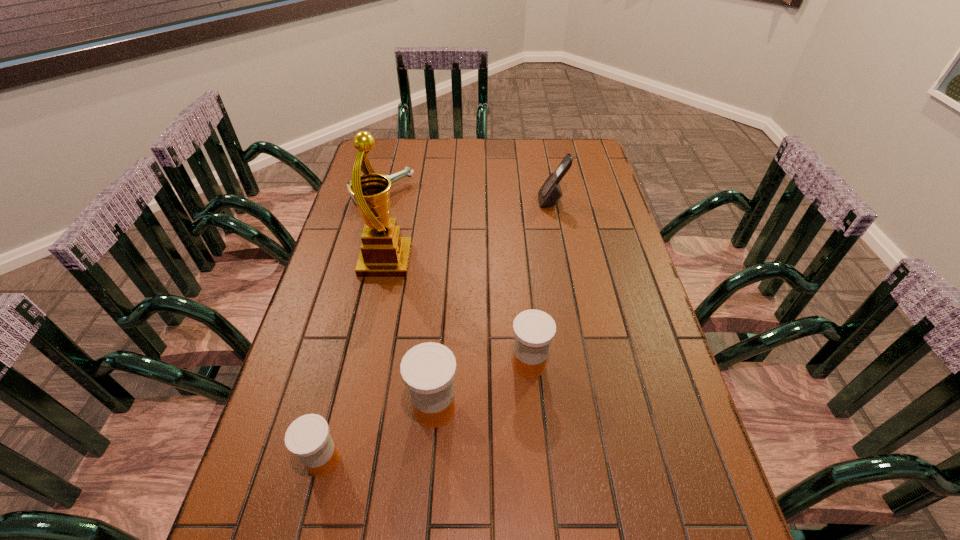
The image size is (960, 540). I want to click on the nearest medicine, so click(308, 437).

At what (x,y) coordinates should I click in order to perform the action: click on the shortest medicine. Please return your answer as a coordinate pair (x, y). The width and height of the screenshot is (960, 540). Looking at the image, I should click on (308, 437).

You are a GUI agent. You are given a task and a screenshot of the screen. Output one action in this format:
    pyautogui.click(x=<x>, y=<y>)
    Task: Click on the second medicine from left to right
    This screenshot has height=540, width=960.
    Given the screenshot: What is the action you would take?
    pyautogui.click(x=428, y=369)

The height and width of the screenshot is (540, 960). Find the location of `the fourth object from left to right`. the fourth object from left to right is located at coordinates (428, 369).

I want to click on the fifth object from left to right, so click(x=534, y=330).

Image resolution: width=960 pixels, height=540 pixels. Identify the location of the rightmost medicine. (534, 330).

Locate an element on the screen. This screenshot has height=540, width=960. the shortest object is located at coordinates (408, 171).

At what (x,y) coordinates should I click in order to perform the action: click on the rightmost object. Please return your answer as a coordinate pair (x, y). Looking at the image, I should click on (550, 193).

I want to click on award, so click(384, 253).

You are a GUI agent. You are given a task and a screenshot of the screen. Output one action in this format:
    pyautogui.click(x=<x>, y=<y>)
    Task: Click on the tallest object
    Image resolution: width=960 pixels, height=540 pixels.
    Given the screenshot: What is the action you would take?
    pyautogui.click(x=384, y=253)